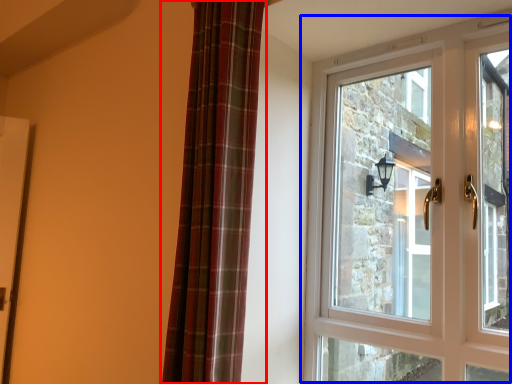
Question: Which object is further to the camera taking this photo, curtain (highlighted by a red box) or window (highlighted by a blue box)?

Choices:
 (A) curtain
 (B) window

Answer: (B)